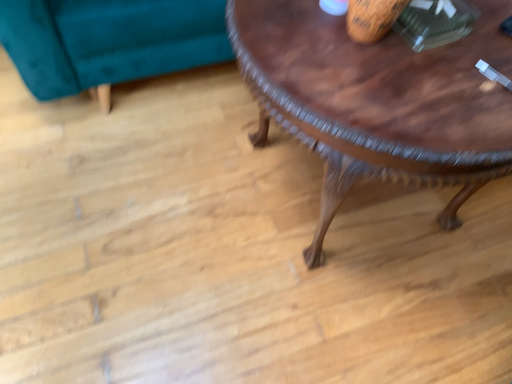
Where is `vacant point to the left of wooden carved coffee table at center`? vacant point to the left of wooden carved coffee table at center is located at coordinates (120, 239).